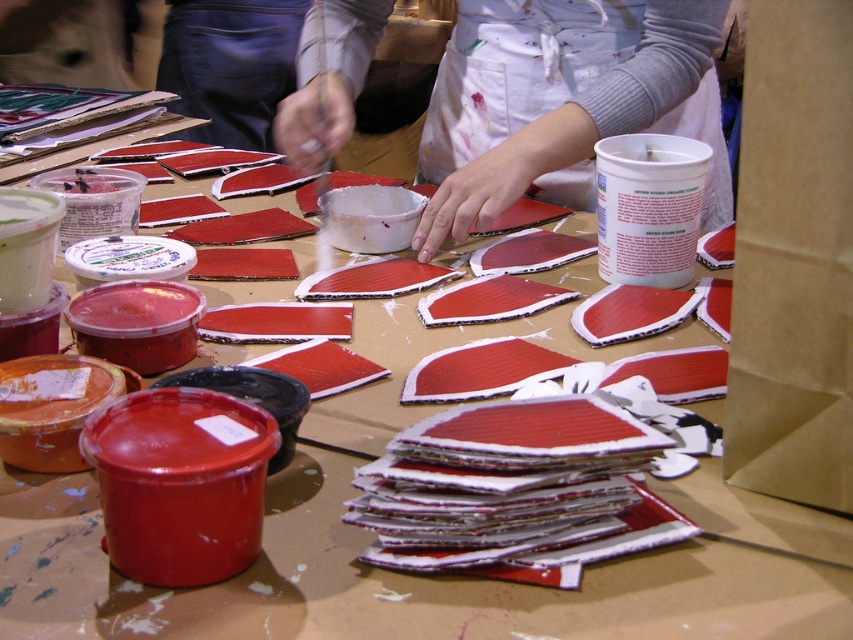
From the picture: You are an artist who needs to reach for a tool located 60 centimeters away from your current position. You see the brown paper bag at right and the white apron at center. Can you reach both items without moving your feet?

The distance between the brown paper bag at right and white apron at center is 55.26 centimeters. Since the tool is 60 centimeters away, you can reach both items as the distance between them is less than 60 centimeters.